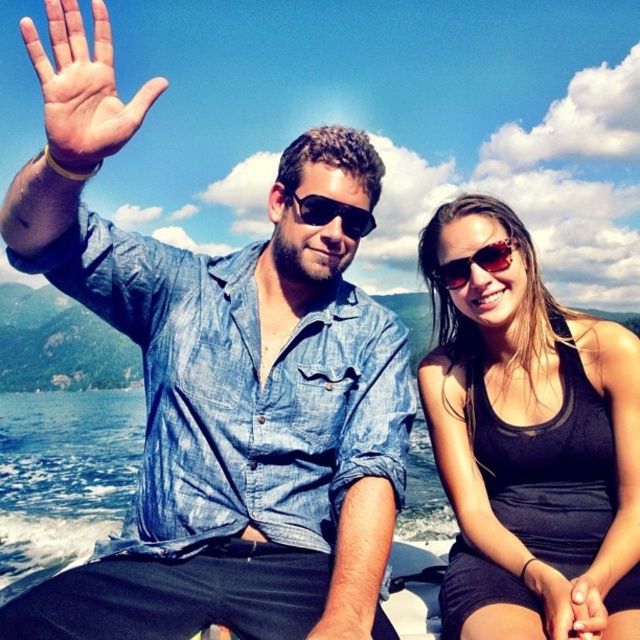
You are a photographer trying to capture a candid shot of the two people on the boat. You notice the black matte tank top at right and the sunglasses at center. Which object should you focus on first if you want to ensure both are in focus without adjusting the camera settings?

The black matte tank top at right is closer to the viewer than the sunglasses at center. To keep both in focus, focus on the closer object first, so you should focus on the black matte tank top at right.

You are a photographer trying to capture a closeup shot of the sunglasses at center. You notice there is a matte skin palm at upper left in the frame. Based on their sizes, which object would appear more prominent in the photo?

The matte skin palm at upper left would appear more prominent in the photo because it has a larger size compared to the sunglasses at center.